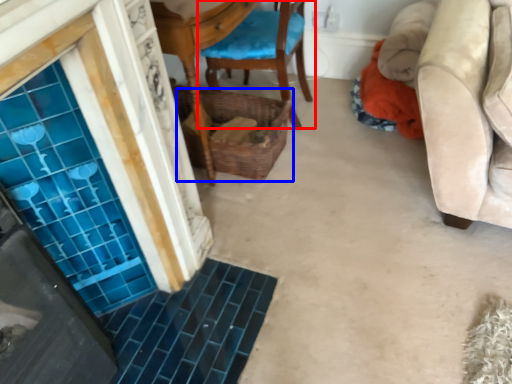
Question: Which object is further to the camera taking this photo, chair (highlighted by a red box) or basket (highlighted by a blue box)?

Choices:
 (A) chair
 (B) basket

Answer: (B)